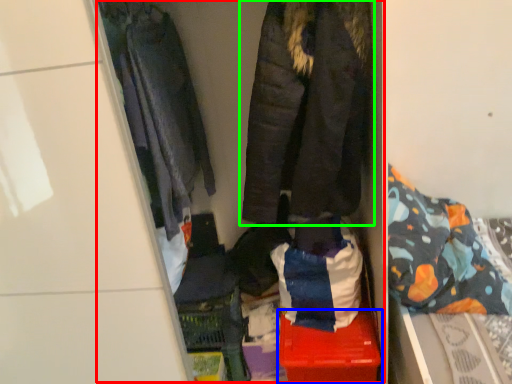
Question: Based on their relative distances, which object is farther from closet (highlighted by a red box)? Choose from storage box (highlighted by a blue box) and jacket (highlighted by a green box).

Choices:
 (A) storage box
 (B) jacket

Answer: (A)